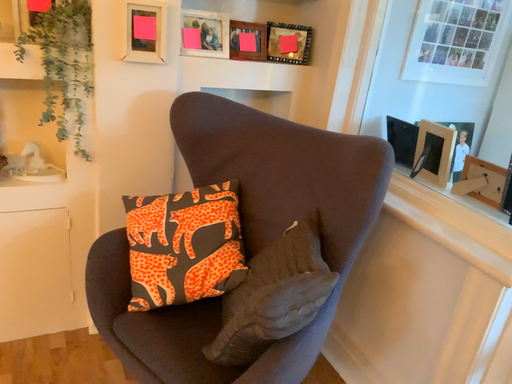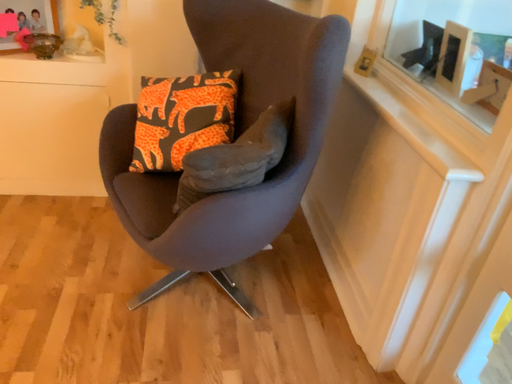
Question: How did the camera likely rotate when shooting the video?

Choices:
 (A) rotated left
 (B) rotated right

Answer: (A)